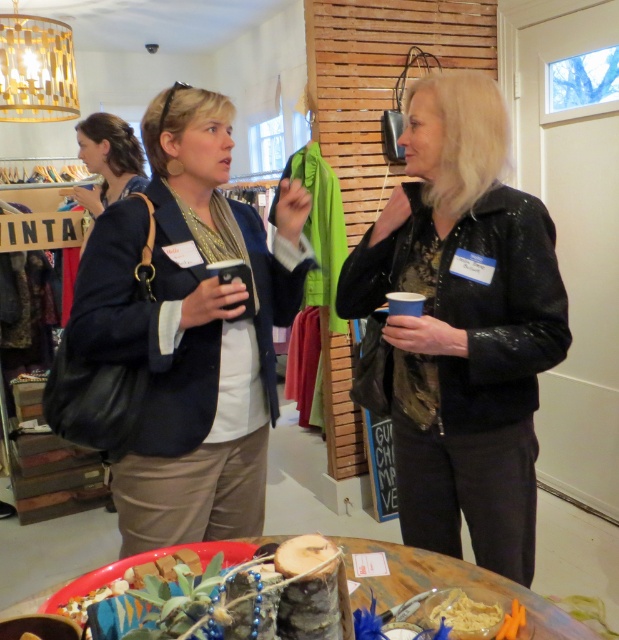
Between wooden log at center and matte black purse at upper left, which one is positioned higher?

matte black purse at upper left is above.

In the scene shown: Is wooden log at center to the right of matte black purse at upper left from the viewer's perspective?

Indeed, wooden log at center is positioned on the right side of matte black purse at upper left.

Which is in front, point (396, 566) or point (105, 145)?

Point (396, 566)

Image resolution: width=619 pixels, height=640 pixels. What are the coordinates of `wooden log at center` in the screenshot? It's located at (449, 582).

Does matte black blazer at left have a smaller size compared to matte black purse at upper left?

Incorrect, matte black blazer at left is not smaller in size than matte black purse at upper left.

Which of these two, matte black blazer at left or matte black purse at upper left, stands taller?

With more height is matte black blazer at left.

Based on the photo, who is more distant from viewer, (194, 528) or (113, 173)?

Point (113, 173)

This screenshot has height=640, width=619. Find the location of `matte black blazer at left`. matte black blazer at left is located at coordinates (191, 328).

Can you confirm if black sequined jacket at center is smaller than wooden log at center?

No, black sequined jacket at center is not smaller than wooden log at center.

Who is more distant from viewer, (529,396) or (360,589)?

The point (529,396) is behind.

In order to click on black sequined jacket at center in this screenshot , I will do `click(464, 324)`.